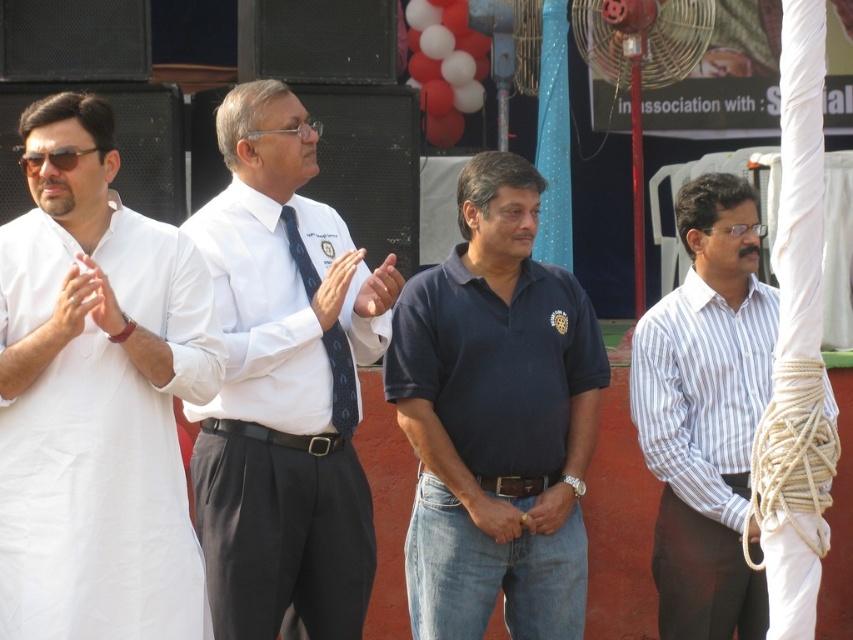
You are a photographer at the event and need to adjust the lighting to highlight both the blue silk tie at center and the brown leather belt at center. Since the belt is lower, should you angle the light upwards or downwards to ensure both are well lit?

The blue silk tie at center is above the brown leather belt at center. To ensure both are well lit, angle the light downwards towards the belt while still illuminating the tie above.

You are organizing a photo shoot and need to arrange the models according to their clothing layers. Based on the image, which clothing item is layered over the other between the white cotton kurta at left and the white striped shirt at right?

The white cotton kurta at left is positioned over the white striped shirt at right, so the kurta is layered over the shirt.